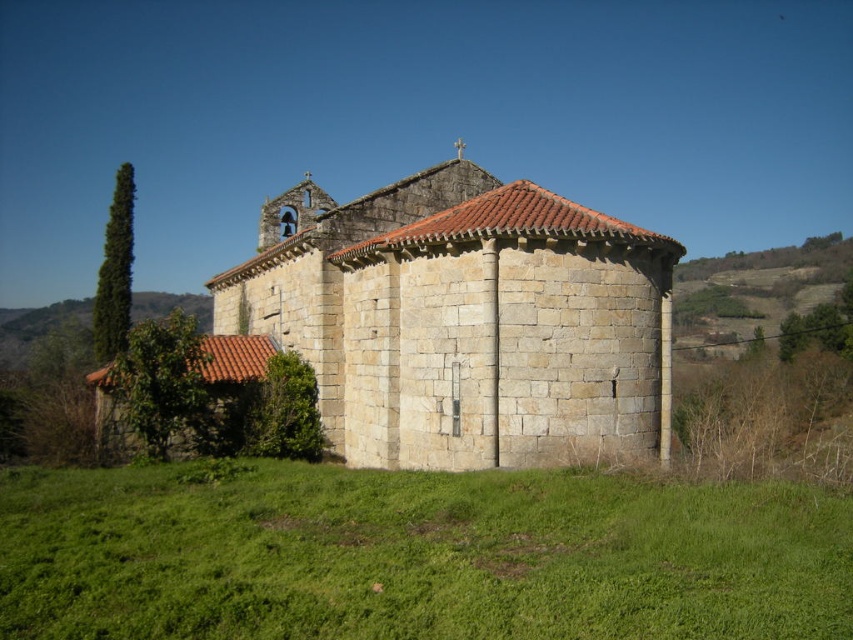
You are a landscape architect planning to add a new garden bed between the green grass at lower center and the stone textured chapel at center. Considering their sizes, which area should the garden bed be placed closer to?

The garden bed should be placed closer to the green grass at lower center because it is smaller than the stone textured chapel at center, allowing for better balance in the design.

You are a gardener who needs to mow the lawn around the stone textured chapel at center. Based on the scene, can you determine if the green grass at lower center is tall enough to require mowing?

The green grass at lower center is shorter than the stone textured chapel at center, but since the chapel is a structure and not grass, the comparison doesn